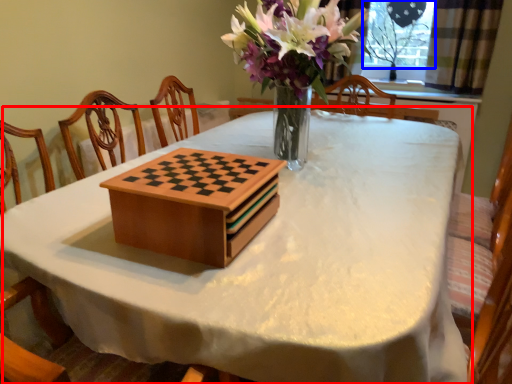
Question: Which point is further to the camera, table (highlighted by a red box) or window screen (highlighted by a blue box)?

Choices:
 (A) table
 (B) window screen

Answer: (B)